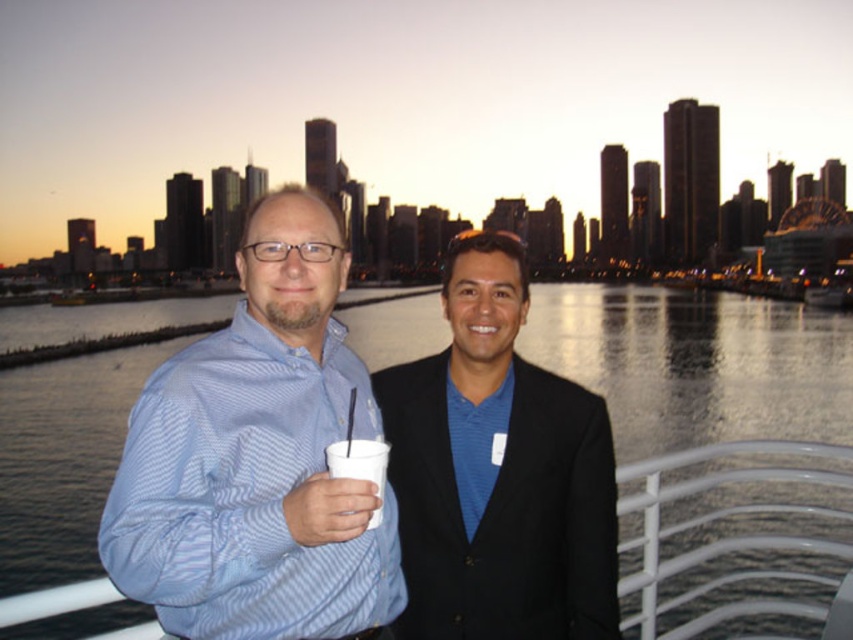
Based on the photo, who is more forward, [57,397] or [351,472]?

Point [351,472] is more forward.

Can you confirm if clear water at center is positioned above white paper cup at center?

Yes, clear water at center is above white paper cup at center.

Which is in front, point (663, 416) or point (363, 476)?

Point (363, 476)

The height and width of the screenshot is (640, 853). Identify the location of clear water at center. point(698,364).

Who is more forward, (178, 352) or (553, 426)?

Point (553, 426)

Is point (196, 470) more distant than point (451, 330)?

No, (196, 470) is in front of (451, 330).

Does point (315, 381) come behind point (525, 488)?

No, (315, 381) is closer to viewer.

This screenshot has width=853, height=640. Find the location of `blue striped shirt at center`. blue striped shirt at center is located at coordinates (258, 458).

Does blue smooth shirt at center have a lesser width compared to white paper cup at center?

No, blue smooth shirt at center is not thinner than white paper cup at center.

Is blue smooth shirt at center below white paper cup at center?

Actually, blue smooth shirt at center is above white paper cup at center.

Is point (555, 435) farther from camera compared to point (373, 449)?

Yes, it is.

I want to click on blue smooth shirt at center, so click(x=498, y=472).